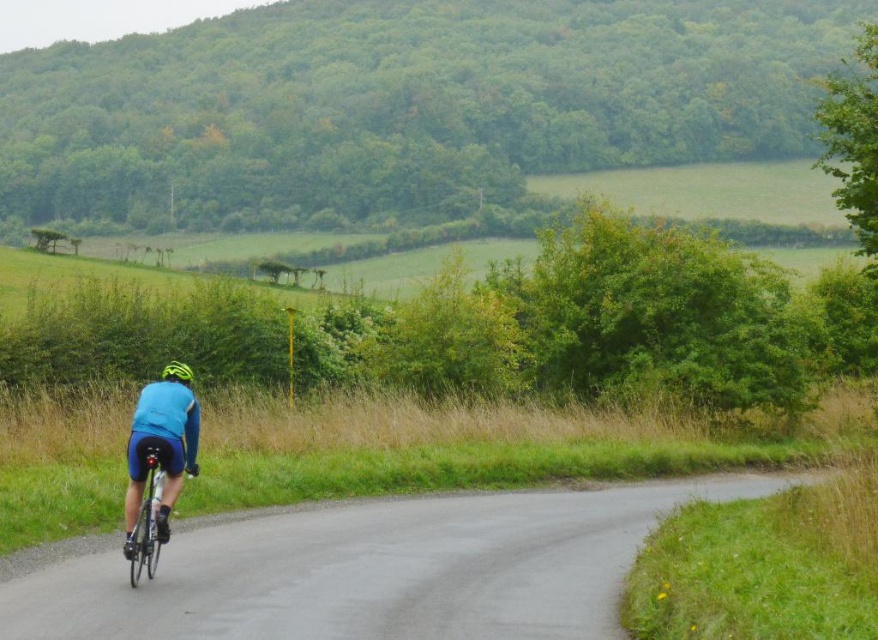
You are a photographer trying to capture the cyclist in the scene. Since the blue fabric cyclist at center and the green matte helmet at center are both in your view, which one would appear closer to you?

The blue fabric cyclist at center appears closer because it is positioned in front of the green matte helmet at center.

You are a drone operator trying to capture a photo of the cyclist. The drone is at point (630, 44). The camera is 109.45 meters away from this point. Can the drone safely descend vertically to take a photo without hitting the cyclist?

The drone at point (630, 44) is 109.45 meters away from the camera. Since the drone needs to descend vertically, the distance between them is sufficient for safe descent without collision.

You are a photographer planning to capture a cyclist in a rural setting. You need to ensure that the shiny metallic bicycle at center and the green matte helmet at center are both clearly visible in your shot. Given their sizes, which object should you focus on to ensure both are in frame without needing to adjust your camera angle?

The shiny metallic bicycle at center is much taller than the green matte helmet at center, so focusing on the bicycle will ensure both objects are within the frame without needing to adjust the camera angle.